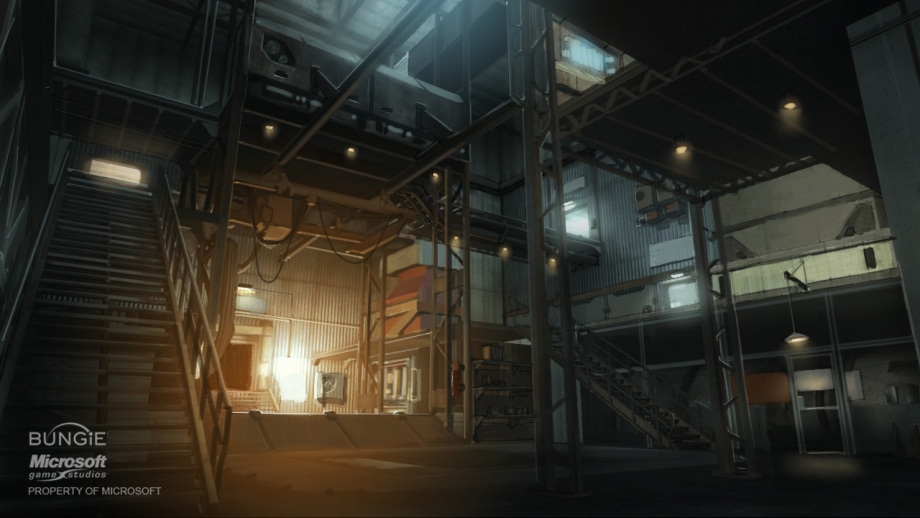
I want to click on lights on the ceiling, so click(x=270, y=131), click(x=351, y=157), click(x=438, y=172), click(x=454, y=242), click(x=504, y=255), click(x=553, y=262), click(x=684, y=151), click(x=795, y=110), click(x=794, y=336).